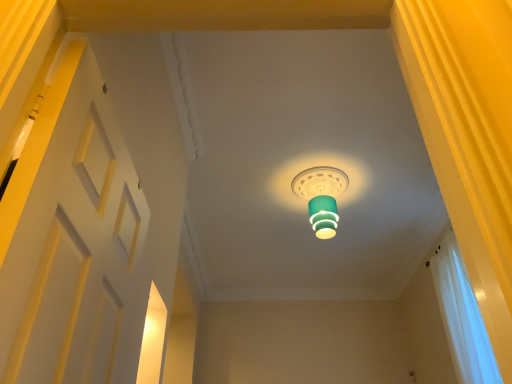
Question: Based on their positions, is white matte door at left located to the left or right of white sheer curtain at right?

Choices:
 (A) left
 (B) right

Answer: (A)

Question: Is white matte door at left situated inside white sheer curtain at right or outside?

Choices:
 (A) outside
 (B) inside

Answer: (A)

Question: Estimate the real-world distances between objects in this image. Which object is closer to the white sheer curtain at right?

Choices:
 (A) white matte door at left
 (B) teal glossy lampshade at center

Answer: (B)

Question: Which of these objects is positioned closest to the teal glossy lampshade at center?

Choices:
 (A) white sheer curtain at right
 (B) white matte door at left

Answer: (A)